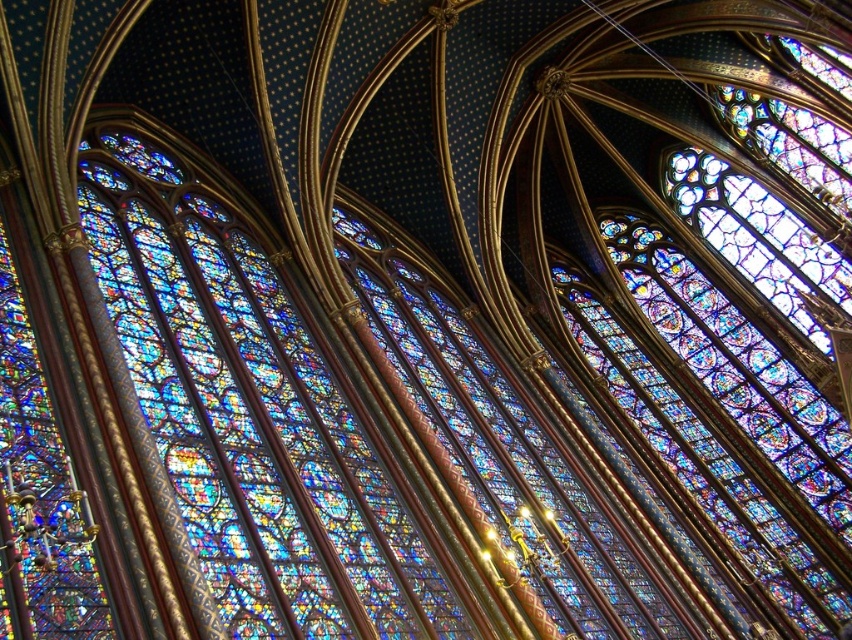
Where is `multicolored stained glass window at center`? This screenshot has width=852, height=640. multicolored stained glass window at center is located at coordinates (252, 419).

Does multicolored stained glass window at center come behind stained glass window at center?

No.

Where is `multicolored stained glass window at center`? This screenshot has height=640, width=852. multicolored stained glass window at center is located at coordinates pyautogui.click(x=252, y=419).